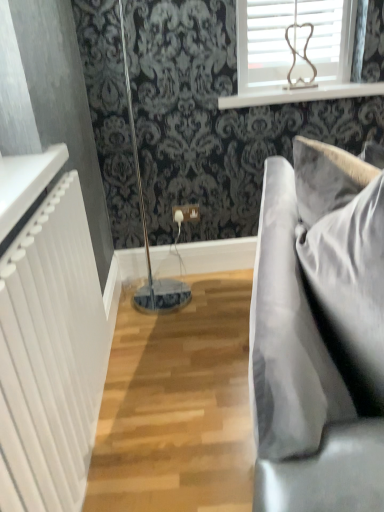
Image resolution: width=384 pixels, height=512 pixels. Describe the element at coordinates (300, 94) in the screenshot. I see `white wood window sill at upper center` at that location.

The width and height of the screenshot is (384, 512). What are the coordinates of `velvet grey couch at right` in the screenshot? It's located at (319, 332).

Identify the location of white wood window sill at upper center. This screenshot has width=384, height=512. (300, 94).

Between velvet gray pillow at right and velvet grey couch at right, which one has smaller size?

velvet gray pillow at right is smaller.

Which of these two, velvet gray pillow at right or velvet grey couch at right, stands taller?

Standing taller between the two is velvet grey couch at right.

From the image's perspective, does velvet gray pillow at right appear lower than velvet grey couch at right?

Actually, velvet gray pillow at right appears above velvet grey couch at right in the image.

From a real-world perspective, is velvet gray pillow at right physically located above or below white textured radiator at left?

From a real-world perspective, velvet gray pillow at right is physically above white textured radiator at left.

Does velvet gray pillow at right have a lesser width compared to white textured radiator at left?

Incorrect, the width of velvet gray pillow at right is not less than that of white textured radiator at left.

Locate an element on the screen. The width and height of the screenshot is (384, 512). pillow located on the right of white textured radiator at left is located at coordinates (350, 291).

Does velvet gray pillow at right lie behind white textured radiator at left?

Yes.

Who is more distant, velvet grey couch at right or white wood window sill at upper center?

white wood window sill at upper center is behind.

Is white wood window sill at upper center located within velvet grey couch at right?

No, white wood window sill at upper center is not inside velvet grey couch at right.

Considering the relative positions of velvet grey couch at right and white wood window sill at upper center in the image provided, is velvet grey couch at right to the right of white wood window sill at upper center from the viewer's perspective?

Incorrect, velvet grey couch at right is not on the right side of white wood window sill at upper center.

From the image's perspective, is white wood window sill at upper center located above white textured radiator at left?

Yes.

Which is more to the left, white wood window sill at upper center or white textured radiator at left?

white textured radiator at left is more to the left.

Image resolution: width=384 pixels, height=512 pixels. In order to click on window sill that is above the white textured radiator at left (from a real-world perspective) in this screenshot , I will do `click(300, 94)`.

Are velvet grey couch at right and white textured radiator at left making contact?

No.

Is velvet grey couch at right positioned in front of white textured radiator at left?

Yes, velvet grey couch at right is closer to the viewer.

Can you confirm if velvet grey couch at right is wider than white textured radiator at left?

Correct, the width of velvet grey couch at right exceeds that of white textured radiator at left.

Who is taller, velvet grey couch at right or white textured radiator at left?

Standing taller between the two is velvet grey couch at right.

Which object is positioned more to the right, white textured radiator at left or velvet grey couch at right?

Positioned to the right is velvet grey couch at right.

Is point (90, 261) behind point (290, 340)?

Yes, point (90, 261) is farther from viewer.

Is velvet grey couch at right at the back of white textured radiator at left?

No, white textured radiator at left is not facing the opposite direction of velvet grey couch at right.

Which of these two, white textured radiator at left or velvet gray pillow at right, is smaller?

Smaller between the two is white textured radiator at left.

From the image's perspective, is white textured radiator at left located above or below velvet gray pillow at right?

Based on their image positions, white textured radiator at left is located beneath velvet gray pillow at right.

Could you tell me if white textured radiator at left is turned towards velvet gray pillow at right?

Yes, white textured radiator at left is facing velvet gray pillow at right.

Find the location of a particular element. pillow that is on the left side of velvet grey couch at right is located at coordinates (350, 291).

Locate an element on the screen. pillow to the right of white textured radiator at left is located at coordinates (350, 291).

Based on the photo, considering their positions, is white wood window sill at upper center positioned further to white textured radiator at left than velvet grey couch at right?

white wood window sill at upper center.

When comparing their distances from velvet grey couch at right, does white wood window sill at upper center or velvet gray pillow at right seem closer?

velvet gray pillow at right is positioned closer to the anchor velvet grey couch at right.

From the image, which object appears to be farther from white wood window sill at upper center, white textured radiator at left or velvet gray pillow at right?

velvet gray pillow at right is positioned further to the anchor white wood window sill at upper center.

Which object lies nearer to the anchor point white wood window sill at upper center, white textured radiator at left or velvet grey couch at right?

velvet grey couch at right lies closer to white wood window sill at upper center than the other object.

From the image, which object appears to be nearer to velvet gray pillow at right, velvet grey couch at right or white wood window sill at upper center?

The object closer to velvet gray pillow at right is velvet grey couch at right.

When comparing their distances from velvet gray pillow at right, does white textured radiator at left or white wood window sill at upper center seem further?

white wood window sill at upper center lies further to velvet gray pillow at right than the other object.

Which object lies further to the anchor point velvet gray pillow at right, velvet grey couch at right or white textured radiator at left?

white textured radiator at left.

Looking at the image, which one is located further to velvet grey couch at right, white wood window sill at upper center or white textured radiator at left?

white wood window sill at upper center.

At what (x,y) coordinates should I click in order to perform the action: click on pillow between white textured radiator at left and velvet grey couch at right. Please return your answer as a coordinate pair (x, y). This screenshot has width=384, height=512. Looking at the image, I should click on (350, 291).

The image size is (384, 512). What are the coordinates of `radiator located between velvet grey couch at right and white wood window sill at upper center in the depth direction` in the screenshot? It's located at (51, 355).

Locate an element on the screen. The height and width of the screenshot is (512, 384). pillow between velvet grey couch at right and white wood window sill at upper center in the front-back direction is located at coordinates (350, 291).

You are a GUI agent. You are given a task and a screenshot of the screen. Output one action in this format:
    pyautogui.click(x=<x>, y=<y>)
    Task: Click on the pillow between white textured radiator at left and white wood window sill at upper center from front to back
    This screenshot has height=512, width=384.
    Given the screenshot: What is the action you would take?
    (x=350, y=291)